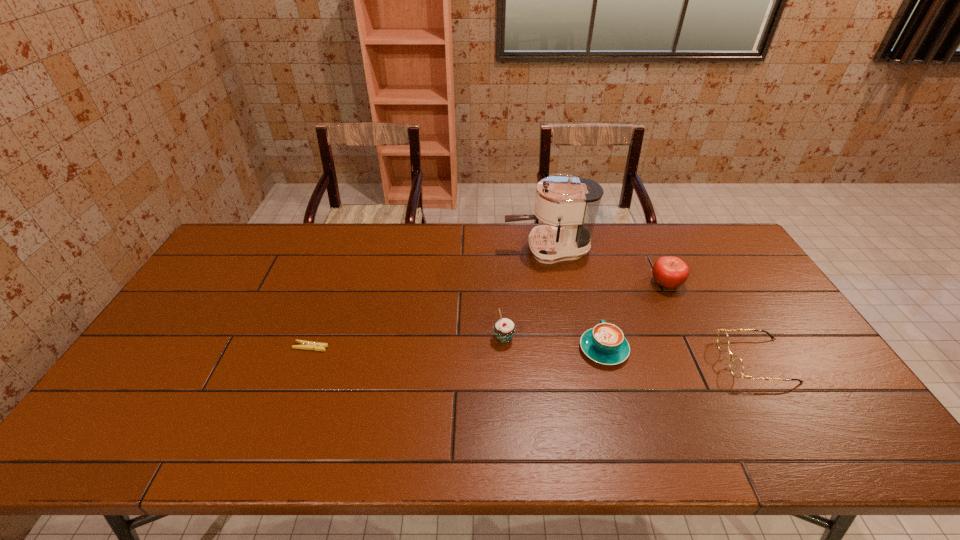
Identify the location of vacant space situated 0.380m on the back of the clothespin. This screenshot has width=960, height=540. (344, 258).

Identify the location of object positioned at the far edge. The width and height of the screenshot is (960, 540). (571, 202).

Locate an element on the screen. object situated at the right edge is located at coordinates (736, 365).

At what (x,y) coordinates should I click in order to perform the action: click on vacant space at the far edge of the desktop. Please return your answer as a coordinate pair (x, y). The width and height of the screenshot is (960, 540). Looking at the image, I should click on (428, 255).

In the image, there is a desktop. In order to click on vacant space at the near edge in this screenshot , I will do `click(420, 443)`.

Identify the location of vacant space at the right edge of the desktop. Image resolution: width=960 pixels, height=540 pixels. [806, 363].

This screenshot has width=960, height=540. In order to click on free space at the far left corner of the desktop in this screenshot , I will do `click(266, 222)`.

I want to click on free point at the far right corner, so click(723, 243).

What are the coordinates of `vacant area between the spectacles and the cupcake` in the screenshot? It's located at (630, 349).

I want to click on free spot between the rightmost object and the second object from right to left, so click(x=711, y=322).